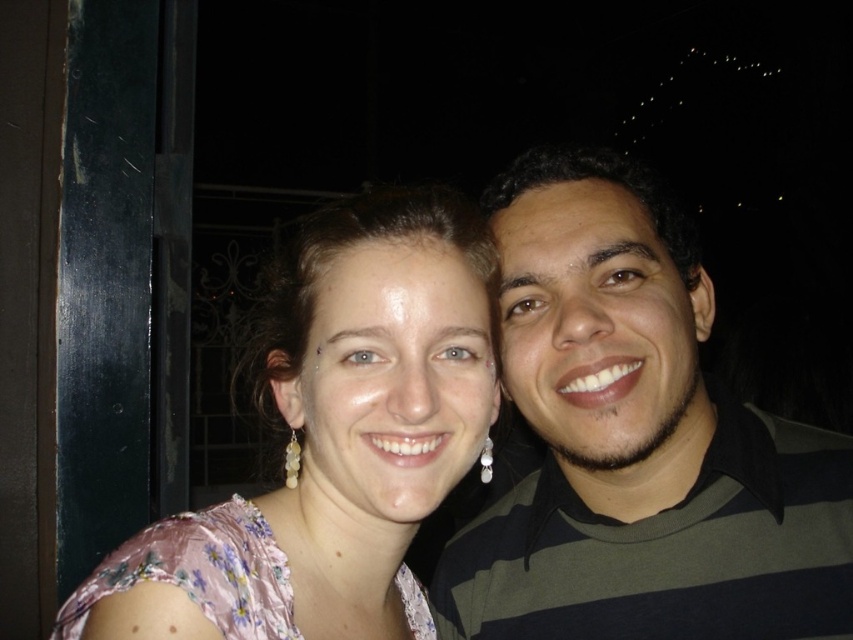
Question: Is striped cotton shirt at right below pink floral dress at center?

Choices:
 (A) yes
 (B) no

Answer: (B)

Question: Can you confirm if striped cotton shirt at right is positioned to the left of pink floral dress at center?

Choices:
 (A) yes
 (B) no

Answer: (B)

Question: Which point is closer to the camera taking this photo?

Choices:
 (A) (378, 436)
 (B) (688, 332)

Answer: (A)

Question: Does striped cotton shirt at right come in front of pink floral dress at center?

Choices:
 (A) yes
 (B) no

Answer: (B)